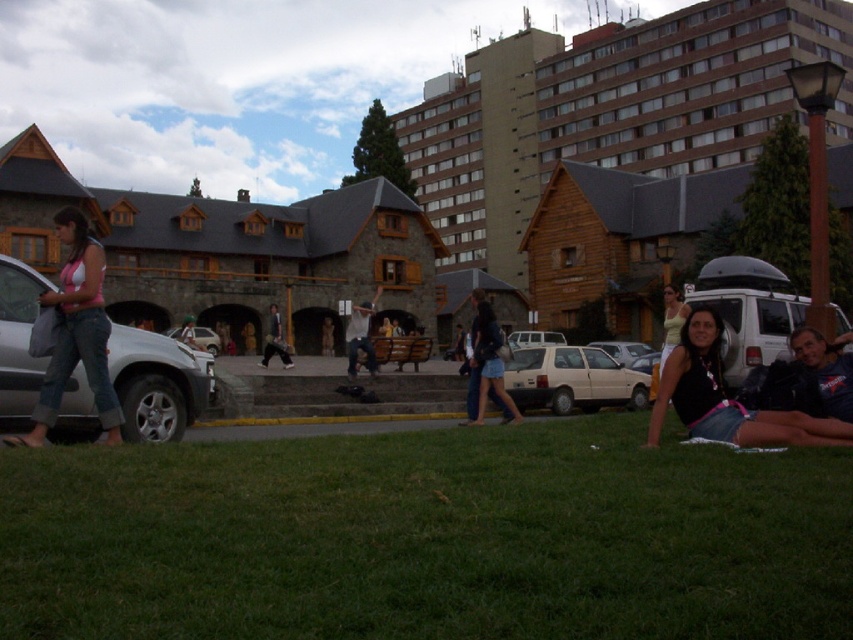
Question: Is green grass at lower center to the right of metallic silver car at center from the viewer's perspective?

Choices:
 (A) no
 (B) yes

Answer: (B)

Question: Does black fabric bikini top at lower right appear on the left side of matte white car at center?

Choices:
 (A) yes
 (B) no

Answer: (A)

Question: Which is farther from the dark blue jeans at center?

Choices:
 (A) silver metallic suv at left
 (B) beige matte hatchback at center
 (C) matte white car at center
 (D) white cotton shirt at center

Answer: (A)

Question: Which point is farther from the camera taking this photo?

Choices:
 (A) (558, 413)
 (B) (270, 332)
 (C) (622, 353)
 (D) (560, 440)

Answer: (C)

Question: Among these objects, which one is nearest to the camera?

Choices:
 (A) green grass at lower center
 (B) silver metallic suv at left
 (C) matte white car at center

Answer: (A)

Question: Is silver metallic suv at left positioned before beige matte hatchback at center?

Choices:
 (A) yes
 (B) no

Answer: (A)